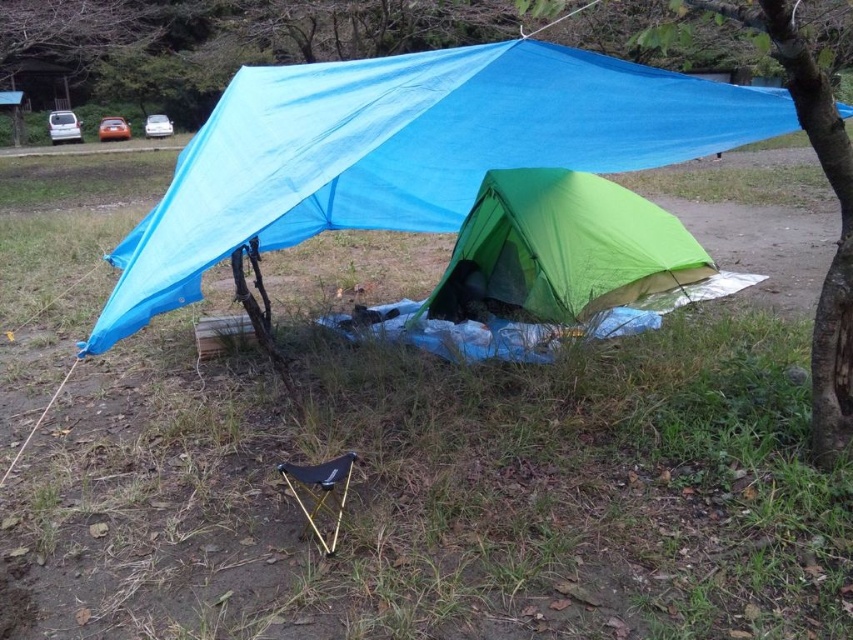
You are setting up a campsite and need to place a new tent. The blue tarp at upper center is already secured. Where should you place the tent to ensure it is under the tarp for protection?

The blue tarp at upper center is located at point (407, 150), so you should place the tent near that coordinate to ensure it is under the tarp for protection.

You are planning to set up a tent in the camping area shown. The blue tarp at upper center is located at point (x=407, y=150). If you want to place your tent so that it is directly below the blue tarp, where should you position it relative to the blue tarp at upper center?

To place your tent directly below the blue tarp at upper center, you should position it at the point directly south of the blue tarp at upper center since the coordinate point (x=407, y=150) indicates its location in the upper center area of the image.

You are setting up a campsite and need to determine which object is taller between the blue tarp at upper center and the green fabric tent at center. Based on the scene, which one is taller?

The blue tarp at upper center is much taller than the green fabric tent at center according to the description.